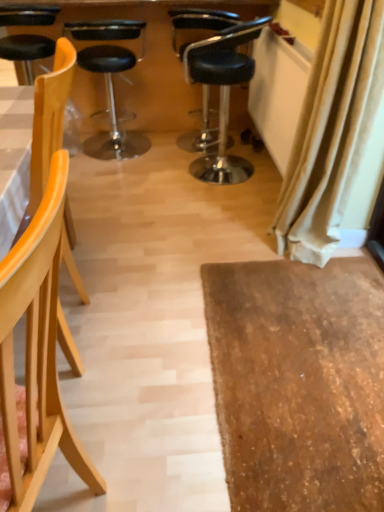
Measure the distance between point (207, 106) and camera.

Point (207, 106) is 3.14 meters from camera.

Find the location of a particular element. beige fabric curtain at right is located at coordinates (332, 129).

What is the approximate width of beige fabric curtain at right?

beige fabric curtain at right is 9.24 inches in width.

I want to click on light wood chair at left, the 4th chair viewed from the back, so click(x=49, y=118).

The width and height of the screenshot is (384, 512). Describe the element at coordinates (222, 93) in the screenshot. I see `black leather stool at center, acting as the third chair starting from the back` at that location.

Identify the location of black leather stool at center, acting as the third chair starting from the front. The height and width of the screenshot is (512, 384). (222, 93).

Find the location of a particular element. black leather chair at center, arranged as the 5th chair when viewed from the front is located at coordinates (199, 24).

Does black leather chair at center, which appears as the first chair when viewed from the back, lie behind light wood chair at left, the 5th chair in the back-to-front sequence?

Yes, the depth of black leather chair at center, which appears as the first chair when viewed from the back, is greater than that of light wood chair at left, the 5th chair in the back-to-front sequence.

Which of these two, black leather chair at center, which appears as the first chair when viewed from the back, or light wood chair at left, the 5th chair in the back-to-front sequence, is bigger?

light wood chair at left, the 5th chair in the back-to-front sequence.

From a real-world perspective, between black leather chair at center, arranged as the 5th chair when viewed from the front, and light wood chair at left, the 5th chair in the back-to-front sequence, who is vertically higher?

light wood chair at left, the 5th chair in the back-to-front sequence, from a real-world perspective.

In terms of height, does light wood chair at left, the 5th chair in the back-to-front sequence, look taller or shorter compared to black leather chair at center, arranged as the 5th chair when viewed from the front?

light wood chair at left, the 5th chair in the back-to-front sequence, is taller than black leather chair at center, arranged as the 5th chair when viewed from the front.

Is light wood chair at left, the first chair in the front-to-back sequence, spatially inside black leather chair at center, which appears as the first chair when viewed from the back, or outside of it?

light wood chair at left, the first chair in the front-to-back sequence, is located beyond the bounds of black leather chair at center, which appears as the first chair when viewed from the back.

Relative to black leather chair at center, arranged as the 5th chair when viewed from the front, is light wood chair at left, the 5th chair in the back-to-front sequence, in front or behind?

In the image, light wood chair at left, the 5th chair in the back-to-front sequence, appears in front of black leather chair at center, arranged as the 5th chair when viewed from the front.

Can you tell me how much black leather stool at center, acting as the third chair starting from the front, and light wood chair at left, acting as the 2th chair starting from the front, differ in facing direction?

The angle between the facing direction of black leather stool at center, acting as the third chair starting from the front, and the facing direction of light wood chair at left, acting as the 2th chair starting from the front, is 89.4 degrees.

In terms of width, does black leather stool at center, acting as the third chair starting from the front, look wider or thinner when compared to light wood chair at left, acting as the 2th chair starting from the front?

Clearly, black leather stool at center, acting as the third chair starting from the front, has more width compared to light wood chair at left, acting as the 2th chair starting from the front.

From the image's perspective, starting from the black leather stool at center, acting as the third chair starting from the front, which chair is the 1st one below? Please provide its 2D coordinates.

[(49, 118)]

Between black leather stool at center, acting as the third chair starting from the front, and light wood chair at left, acting as the 2th chair starting from the front, which one is positioned behind?

black leather stool at center, acting as the third chair starting from the front, is further from the camera.

There is a black leather stool at center, acting as the third chair starting from the front. In order to click on the 2nd chair above it (from the image's perspective) in this screenshot , I will do `click(199, 24)`.

Based on the photo, is black leather chair at center, which appears as the first chair when viewed from the back, placed right next to black leather stool at center, acting as the third chair starting from the front?

No.

Based on the photo, what's the angular difference between black leather chair at center, which appears as the first chair when viewed from the back, and black leather stool at center, acting as the third chair starting from the back,'s facing directions?

black leather chair at center, which appears as the first chair when viewed from the back, and black leather stool at center, acting as the third chair starting from the back, are facing 0.000194 degrees away from each other.

From a real-world perspective, is black leather chair at center, arranged as the 5th chair when viewed from the front, physically located above or below beige fabric curtain at right?

In terms of real-world spatial position, black leather chair at center, arranged as the 5th chair when viewed from the front, is below beige fabric curtain at right.

Is black leather chair at center, which appears as the first chair when viewed from the back, oriented towards beige fabric curtain at right?

No, black leather chair at center, which appears as the first chair when viewed from the back, is not turned towards beige fabric curtain at right.

Is black leather chair at center, arranged as the 5th chair when viewed from the front, positioned before beige fabric curtain at right?

No, black leather chair at center, arranged as the 5th chair when viewed from the front, is further to the viewer.

Is black leather chair at center, which appears as the first chair when viewed from the back, positioned far away from beige fabric curtain at right?

Yes, black leather chair at center, which appears as the first chair when viewed from the back, and beige fabric curtain at right are located far from each other.

Considering the relative positions of black leather stool at center, the fourth chair viewed from the front, and light wood chair at left, the 5th chair in the back-to-front sequence, in the image provided, is black leather stool at center, the fourth chair viewed from the front, in front of light wood chair at left, the 5th chair in the back-to-front sequence,?

No, it is not.

Is black leather stool at center, the second chair when ordered from back to front, to the left of light wood chair at left, the 5th chair in the back-to-front sequence, from the viewer's perspective?

Correct, you'll find black leather stool at center, the second chair when ordered from back to front, to the left of light wood chair at left, the 5th chair in the back-to-front sequence.

In terms of height, does black leather stool at center, the fourth chair viewed from the front, look taller or shorter compared to light wood chair at left, the 5th chair in the back-to-front sequence?

black leather stool at center, the fourth chair viewed from the front, is shorter than light wood chair at left, the 5th chair in the back-to-front sequence.

Would you say black leather stool at center, the second chair when ordered from back to front, is inside or outside light wood chair at left, the first chair in the front-to-back sequence?

black leather stool at center, the second chair when ordered from back to front, is not enclosed by light wood chair at left, the first chair in the front-to-back sequence.

From the picture: Which of these two, light wood chair at left, the 4th chair viewed from the back, or black leather stool at center, acting as the third chair starting from the back, is thinner?

Thinner between the two is light wood chair at left, the 4th chair viewed from the back.

At what (x,y) coordinates should I click in order to perform the action: click on the 1st chair in front of the black leather stool at center, acting as the third chair starting from the front. Please return your answer as a coordinate pair (x, y). The height and width of the screenshot is (512, 384). Looking at the image, I should click on (49, 118).

Is light wood chair at left, acting as the 2th chair starting from the front, positioned behind black leather stool at center, acting as the third chair starting from the front?

No, the depth of light wood chair at left, acting as the 2th chair starting from the front, is less than that of black leather stool at center, acting as the third chair starting from the front.

Considering the relative positions of light wood chair at left, acting as the 2th chair starting from the front, and black leather stool at center, acting as the third chair starting from the back, in the image provided, is light wood chair at left, acting as the 2th chair starting from the front, to the right of black leather stool at center, acting as the third chair starting from the back, from the viewer's perspective?

In fact, light wood chair at left, acting as the 2th chair starting from the front, is to the left of black leather stool at center, acting as the third chair starting from the back.

From the light wood chair at left, the first chair in the front-to-back sequence, count 4th chairs backward and point to it. Please provide its 2D coordinates.

[(199, 24)]

This screenshot has width=384, height=512. I want to click on the 1st chair counting from the right side of the light wood chair at left, the first chair in the front-to-back sequence, so click(199, 24).

Looking at the image, which one is located further to beige fabric curtain at right, black leather desk at upper center or light wood chair at left, acting as the 2th chair starting from the front?

black leather desk at upper center lies further to beige fabric curtain at right than the other object.

Considering their positions, is beige fabric curtain at right positioned closer to black leather stool at center, the second chair when ordered from back to front, than black leather chair at center, which appears as the first chair when viewed from the back?

black leather chair at center, which appears as the first chair when viewed from the back, lies closer to black leather stool at center, the second chair when ordered from back to front, than the other object.

Estimate the real-world distances between objects in this image. Which object is further from light wood chair at left, acting as the 2th chair starting from the front, beige fabric curtain at right or black leather desk at upper center?

black leather desk at upper center.

From the image, which object appears to be nearer to black leather chair at center, which appears as the first chair when viewed from the back, black leather stool at center, acting as the third chair starting from the back, or light wood chair at left, the 5th chair in the back-to-front sequence?

black leather stool at center, acting as the third chair starting from the back.

Looking at the image, which one is located closer to black leather stool at center, acting as the third chair starting from the front, black leather desk at upper center or beige fabric curtain at right?

The object closer to black leather stool at center, acting as the third chair starting from the front, is black leather desk at upper center.

Estimate the real-world distances between objects in this image. Which object is closer to light wood chair at left, the first chair in the front-to-back sequence, black leather chair at center, which appears as the first chair when viewed from the back, or black leather desk at upper center?

Based on the image, black leather desk at upper center appears to be nearer to light wood chair at left, the first chair in the front-to-back sequence.

From the image, which object appears to be farther from light wood chair at left, the first chair in the front-to-back sequence, black leather desk at upper center or beige fabric curtain at right?

black leather desk at upper center.

From the image, which object appears to be nearer to light wood chair at left, the first chair in the front-to-back sequence, light wood chair at left, the 4th chair viewed from the back, or black leather desk at upper center?

light wood chair at left, the 4th chair viewed from the back, lies closer to light wood chair at left, the first chair in the front-to-back sequence, than the other object.

Where is `chair between beige fabric curtain at right and black leather stool at center, the fourth chair viewed from the front, in the front-back direction`? This screenshot has width=384, height=512. chair between beige fabric curtain at right and black leather stool at center, the fourth chair viewed from the front, in the front-back direction is located at coordinates (222, 93).

Where is `curtain between light wood chair at left, the 5th chair in the back-to-front sequence, and black leather stool at center, the fourth chair viewed from the front, from front to back`? This screenshot has height=512, width=384. curtain between light wood chair at left, the 5th chair in the back-to-front sequence, and black leather stool at center, the fourth chair viewed from the front, from front to back is located at coordinates (332, 129).

Identify the location of curtain positioned between light wood chair at left, the 5th chair in the back-to-front sequence, and black leather stool at center, acting as the third chair starting from the back, from near to far. The height and width of the screenshot is (512, 384). pos(332,129).

The image size is (384, 512). I want to click on curtain located between light wood chair at left, the 4th chair viewed from the back, and black leather stool at center, the fourth chair viewed from the front, in the depth direction, so click(332, 129).